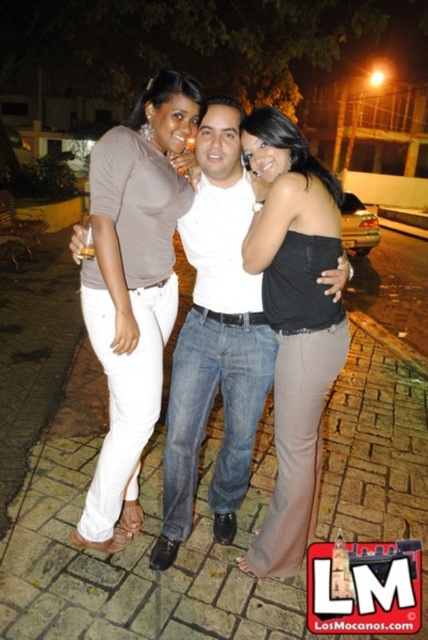
You are a photographer trying to capture a group photo of the matte brown shirt at upper left and the black satin strapless top at center. Considering their sizes, which person should you position closer to the camera to ensure both appear equally sized in the photo?

The matte brown shirt at upper left is wider than the black satin strapless top at center. To make them appear equally sized in the photo, position the black satin strapless top at center closer to the camera since it is narrower.

You are standing at the point labeled point (x=83, y=508) and want to walk to the point labeled point (x=261, y=250). Given that you can only move forward in a straight line, will you be able to reach the destination without deviating from your path?

Since point (x=83, y=508) is behind point (x=261, y=250), you can move forward in a straight line towards the destination without needing to change direction, so yes you can reach it.